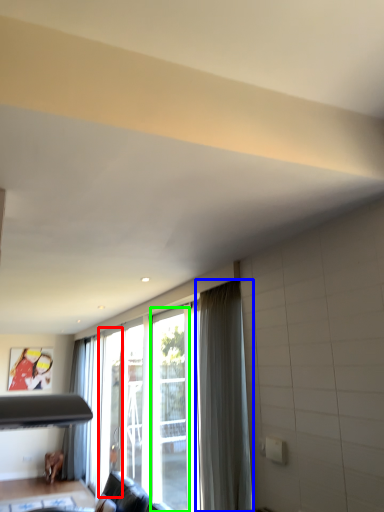
Question: Which is farther away from screen door (highlighted by a red box)? curtain (highlighted by a blue box) or screen door (highlighted by a green box)?

Choices:
 (A) curtain
 (B) screen door

Answer: (A)